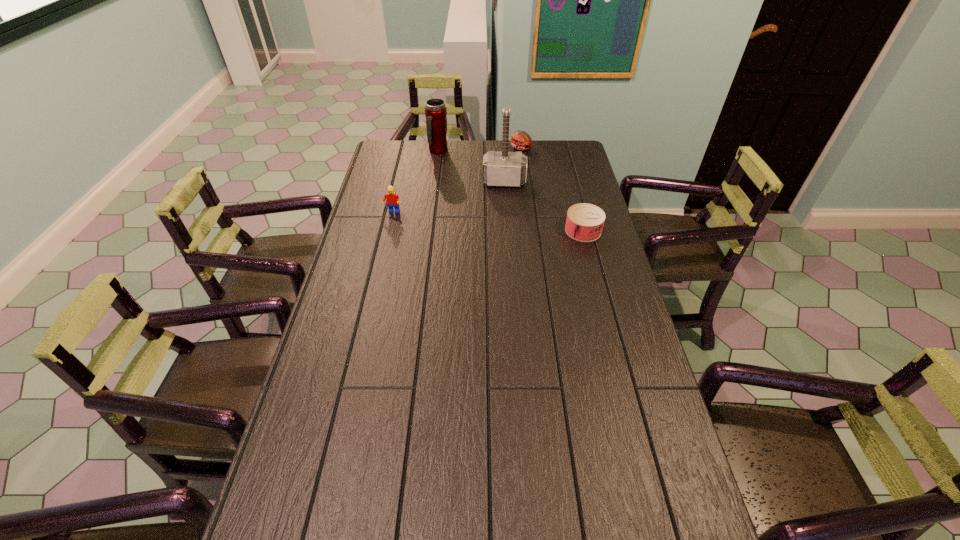
You are a GUI agent. You are given a task and a screenshot of the screen. Output one action in this format:
    pyautogui.click(x=<x>, y=<y>)
    Task: Click on the tomato that is at the far edge
    The image size is (960, 540).
    Given the screenshot: What is the action you would take?
    pyautogui.click(x=521, y=141)

I want to click on thermos bottle that is at the far edge, so click(435, 110).

This screenshot has width=960, height=540. Identify the location of object at the left edge. (393, 200).

Locate an element on the screen. object that is at the right edge is located at coordinates (584, 223).

This screenshot has height=540, width=960. In the image, there is a desktop. Find the location of `vacant space at the far edge`. vacant space at the far edge is located at coordinates (416, 163).

Identify the location of blank space at the left edge of the desktop. (316, 387).

In the image, there is a desktop. Identify the location of free space at the right edge. (612, 338).

This screenshot has width=960, height=540. In order to click on free space at the far right corner of the desktop in this screenshot , I will do `click(577, 150)`.

This screenshot has width=960, height=540. In order to click on blank area at the near right corner in this screenshot , I will do `click(632, 503)`.

You are a GUI agent. You are given a task and a screenshot of the screen. Output one action in this format:
    pyautogui.click(x=<x>, y=<y>)
    Task: Click on the vacant area between the nearest object and the third nearest object
    
    Given the screenshot: What is the action you would take?
    pyautogui.click(x=543, y=206)